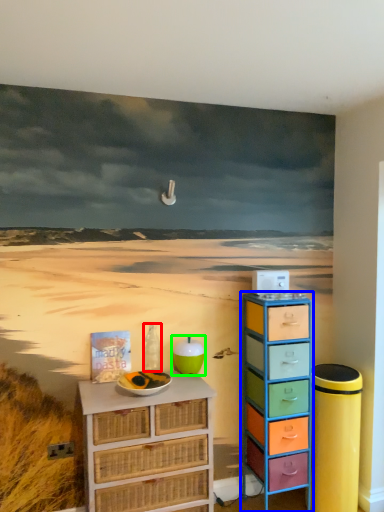
Question: Which is nearer to the bottle (highlighted by a red box)? chest of drawers (highlighted by a blue box) or teal (highlighted by a green box).

Choices:
 (A) chest of drawers
 (B) teal

Answer: (B)